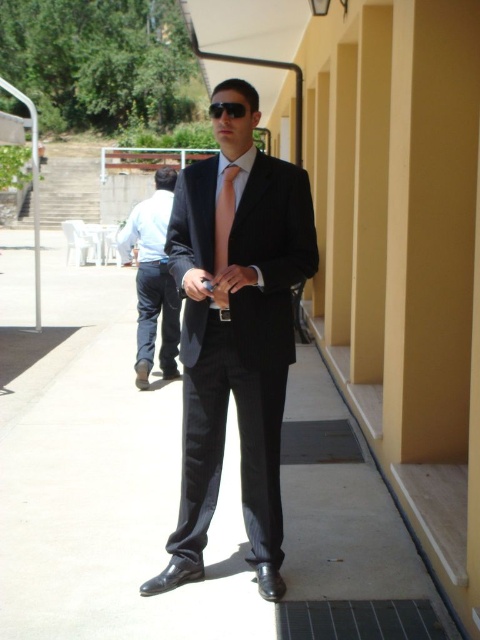
You are a fashion designer observing a man dressed in a black pinstripe suit at center and a pink silk tie at center. Which item of clothing is shorter in height?

The black pinstripe suit at center is shorter in height compared to the pink silk tie at center.

You are a delivery person who needs to place a package on the smooth concrete pavement at center. The package is 1.5 meters tall. Can you safely place it there without it touching the shiny black suit at center?

The smooth concrete pavement at center has a lesser height compared to shiny black suit at center, so the package will not touch the shiny black suit at center when placed there.

You are standing at the camera position and want to throw a small ball to the point marked as point (84, 378). What is the minimum distance you need to throw the ball to reach that point?

The point (84, 378) is 5.95 meters away from the camera, so you need to throw the ball at least 5.95 meters to reach it.